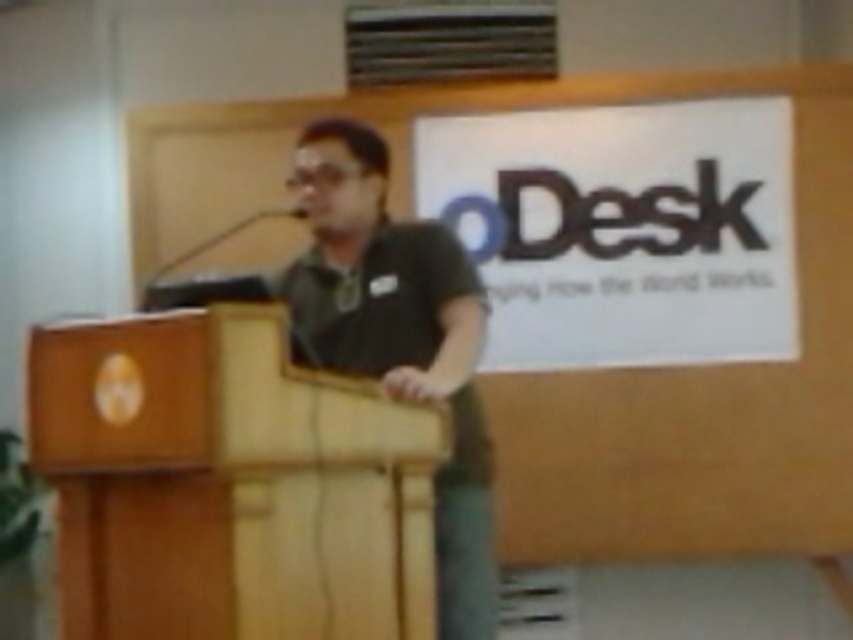
You are taking a photo of the speaker and the podium. The speaker is at point (131,394) and the podium is at point (329,150). Which point is closer to you?

Point (131,394) is closer to the camera than point (329,150).

You are an event organizer setting up a stage for a presentation. You have a wooden podium at center and a black matte shirt at center. Which object is wider?

The wooden podium at center is wider than the black matte shirt at center.

You are an event organizer who needs to adjust the microphone height for the speaker. The wooden podium at center has a microphone attached to it. Considering the speaker is wearing a black matte shirt at center, where is the microphone positioned relative to the speaker?

The wooden podium at center is in front of the black matte shirt at center, so the microphone attached to the wooden podium at center is positioned in front of the speaker wearing the black matte shirt at center.